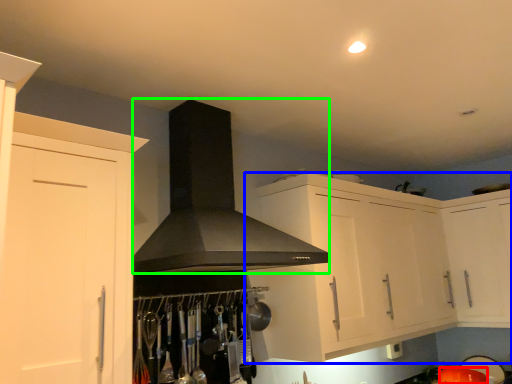
Question: Which object is the closest to the appliance (highlighted by a red box)? Choose among these: cabinetry (highlighted by a blue box) or fume hood (highlighted by a green box).

Choices:
 (A) cabinetry
 (B) fume hood

Answer: (A)